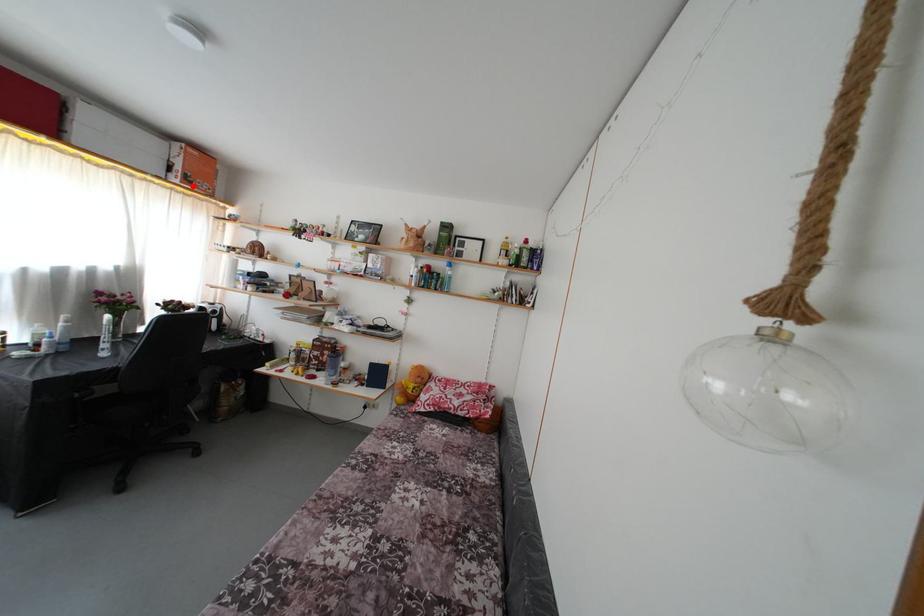
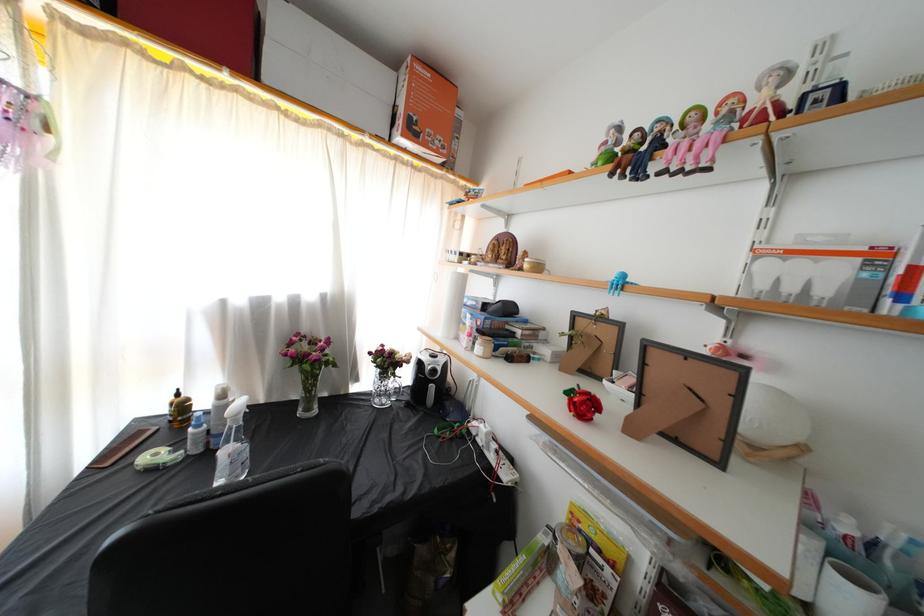
Where in the second image is the point corresponding to the highlighted location from the first image?

(418, 137)